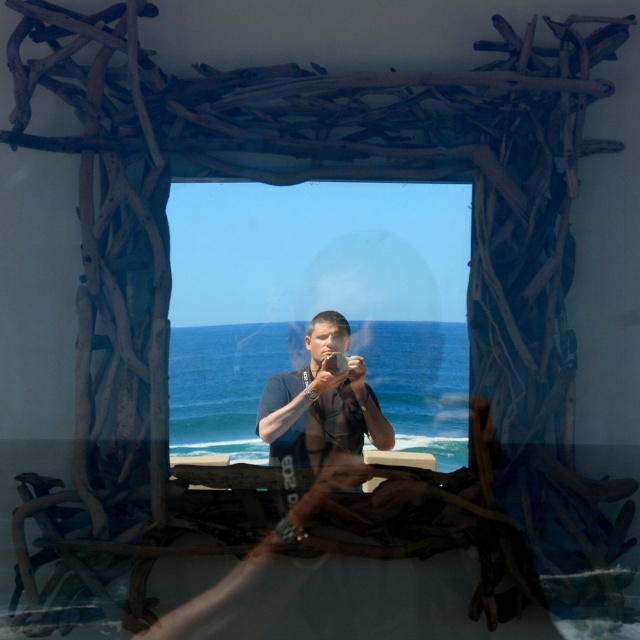
Which is above, transparent glass window at center or dark blue fabric at center?

Positioned higher is transparent glass window at center.

The width and height of the screenshot is (640, 640). I want to click on transparent glass window at center, so click(317, 301).